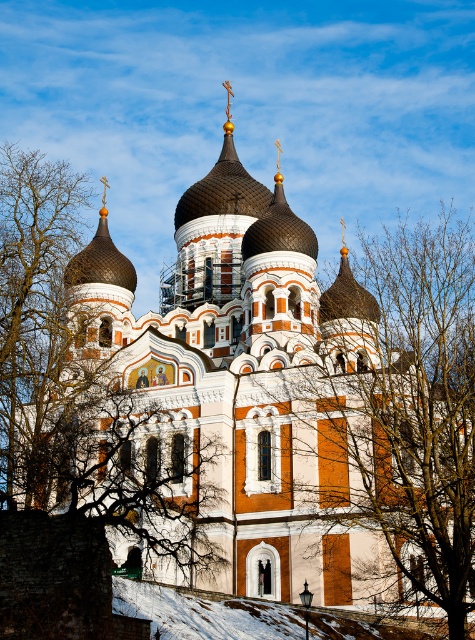
You are a photographer standing at the camera position. You want to take a photo of the brown leafless branches at center. However, you notice that the branches are too far away. What is the minimum distance you need to move closer to the branches to ensure they appear larger in your photo?

The brown leafless branches at center are currently 54.36 meters away. To make them appear larger, you need to move closer so that the distance between you and the branches is less than 54.36 meters.

You are standing in front of the church and want to take a photo of the matte brown dome at upper left without the brown leafless branches at center blocking it. How should you position yourself?

Move to the right side so that the brown leafless branches at center are no longer in front of the matte brown dome at upper left.